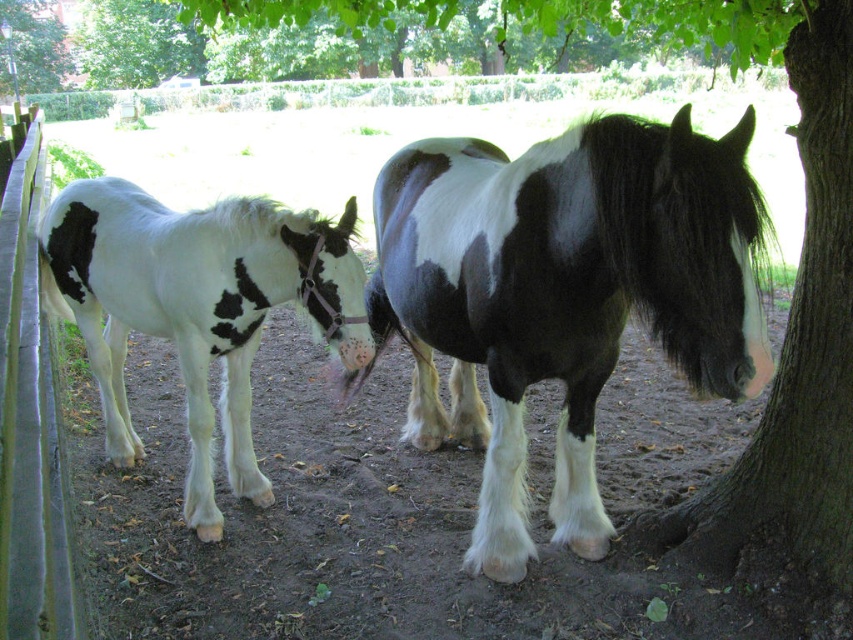
Is wooden at left above green leafy tree at upper left?

No.

Is the position of wooden at left more distant than that of green leafy tree at upper left?

That is False.

Find the location of a particular element. The width and height of the screenshot is (853, 640). wooden at left is located at coordinates (30, 412).

In order to click on wooden at left in this screenshot , I will do `click(30, 412)`.

Between white speckled coat at left and green leafy tree at upper left, which one appears on the right side from the viewer's perspective?

Positioned to the right is white speckled coat at left.

Does white speckled coat at left appear over green leafy tree at upper left?

Incorrect, white speckled coat at left is not positioned above green leafy tree at upper left.

Between point (198, 435) and point (22, 32), which one is positioned in front?

Point (198, 435) is in front.

You are a GUI agent. You are given a task and a screenshot of the screen. Output one action in this format:
    pyautogui.click(x=<x>, y=<y>)
    Task: Click on the white speckled coat at left
    
    Given the screenshot: What is the action you would take?
    pyautogui.click(x=196, y=307)

Describe the element at coordinates (563, 294) in the screenshot. The height and width of the screenshot is (640, 853). I see `black and white speckled horse at center` at that location.

Is black and white speckled horse at center to the right of wooden at left from the viewer's perspective?

Yes, black and white speckled horse at center is to the right of wooden at left.

Find the location of `black and white speckled horse at center`. black and white speckled horse at center is located at coordinates (563, 294).